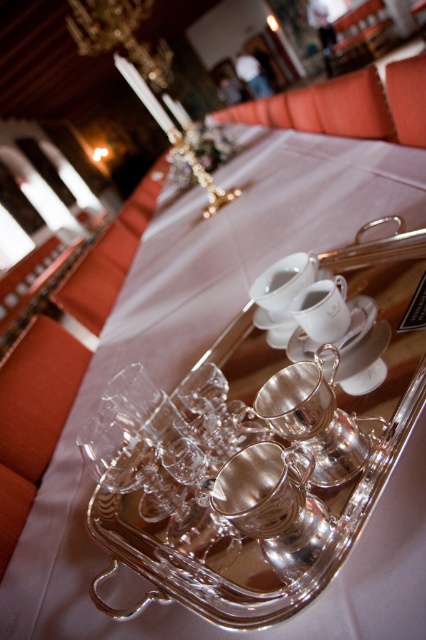
Question: Among these points, which one is nearest to the camera?

Choices:
 (A) (212, 532)
 (B) (356, 336)

Answer: (A)

Question: Is clear glass cups at center below white porcelain saucer at center?

Choices:
 (A) yes
 (B) no

Answer: (A)

Question: Which point appears closest to the camera in this image?

Choices:
 (A) pyautogui.click(x=322, y=508)
 (B) pyautogui.click(x=363, y=307)

Answer: (A)

Question: Considering the relative positions of clear glass cups at center and white porcelain saucer at center in the image provided, where is clear glass cups at center located with respect to white porcelain saucer at center?

Choices:
 (A) left
 (B) right

Answer: (A)

Question: Can you confirm if clear glass cups at center is wider than white porcelain saucer at center?

Choices:
 (A) yes
 (B) no

Answer: (A)